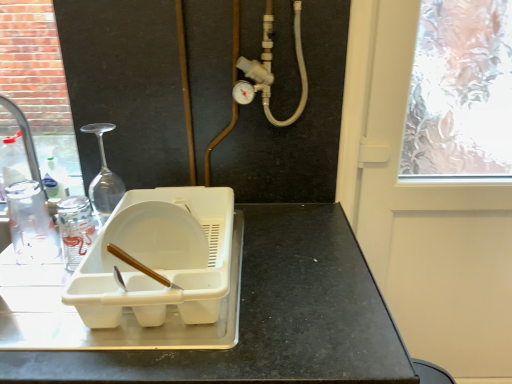
At what (x,y) coordinates should I click in order to perform the action: click on spots to the right of white plastic dish rack at center. Please return your answer as a coordinate pair (x, y). This screenshot has height=384, width=512. Looking at the image, I should click on (303, 269).